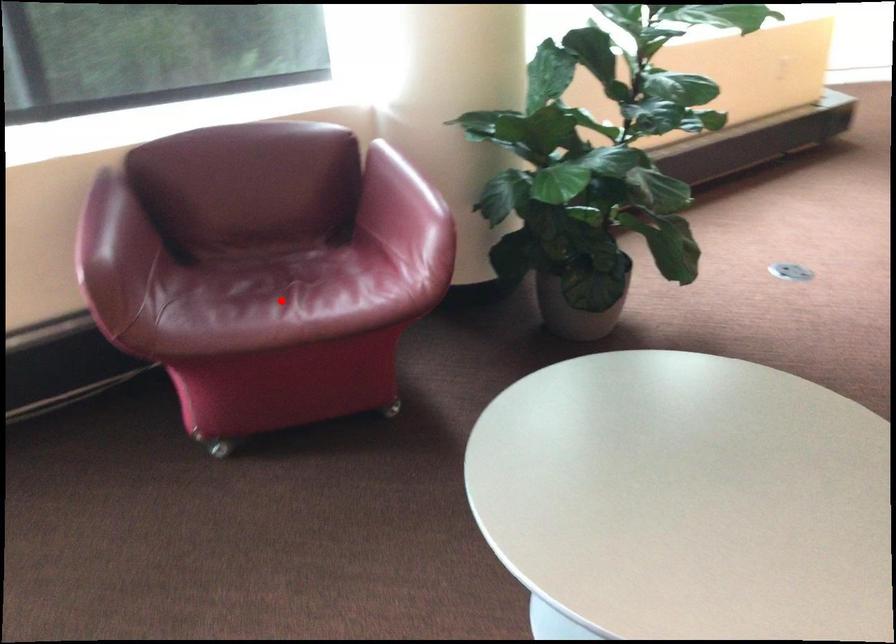
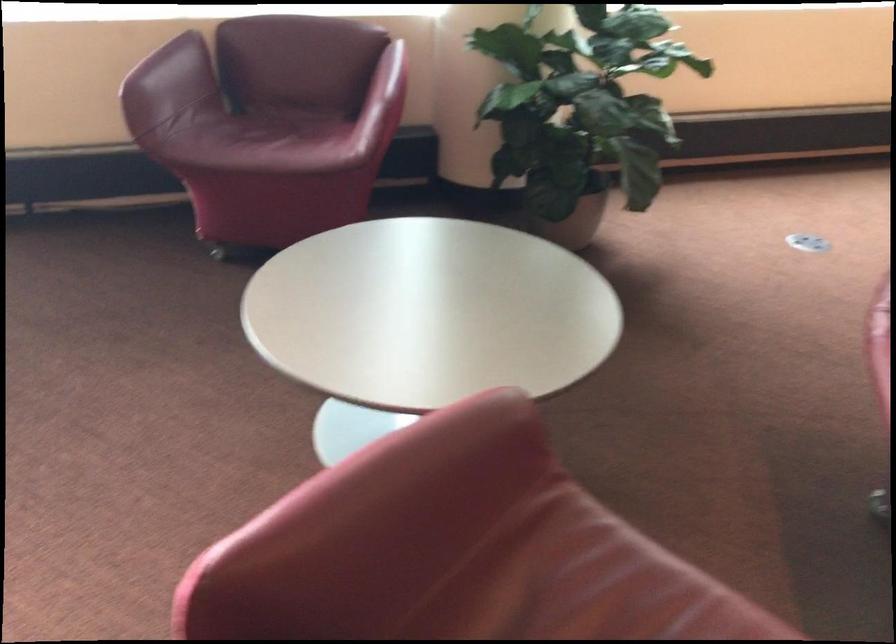
The point at the highlighted location is marked in the first image. Where is the corresponding point in the second image?

(263, 140)